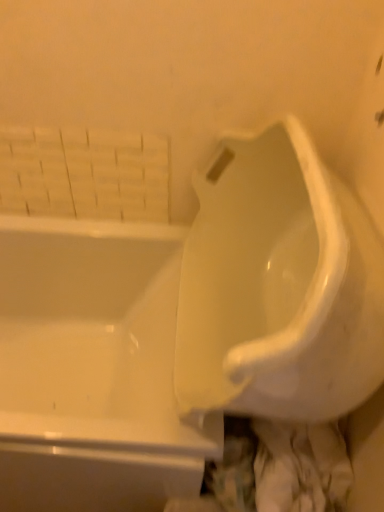
The width and height of the screenshot is (384, 512). What do you see at coordinates (92, 368) in the screenshot?
I see `white glossy bathtub at lower left` at bounding box center [92, 368].

Identify the location of white glossy bathtub at lower left. This screenshot has height=512, width=384. (92, 368).

Identify the location of white glossy bathtub at lower left. pyautogui.click(x=92, y=368).